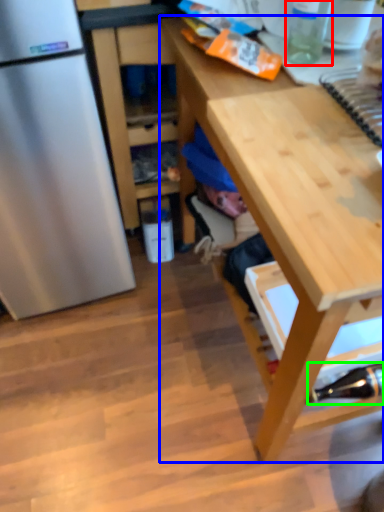
Question: Considering the real-world distances, which object is closest to bottle (highlighted by a red box)? desk (highlighted by a blue box) or bottle (highlighted by a green box).

Choices:
 (A) desk
 (B) bottle

Answer: (A)